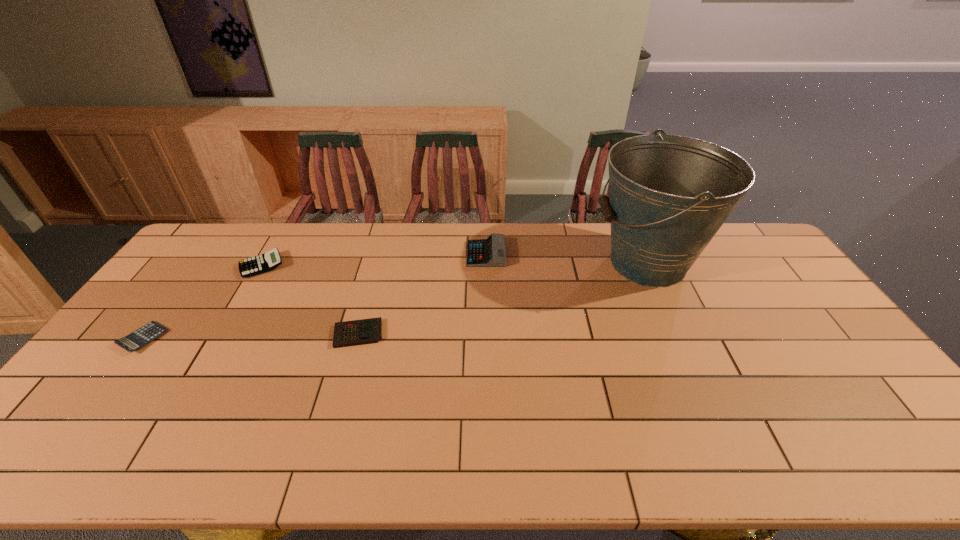
The height and width of the screenshot is (540, 960). Find the location of `free spot at the near edge of the desktop`. free spot at the near edge of the desktop is located at coordinates (385, 440).

Find the location of a particular element. The height and width of the screenshot is (540, 960). free space at the left edge is located at coordinates (187, 273).

At what (x,y) coordinates should I click in order to perform the action: click on vacant space at the right edge of the desktop. Please return your answer as a coordinate pair (x, y). Looking at the image, I should click on click(x=866, y=421).

Identify the location of free space that is in between the fourth object from left to right and the third object from left to right. (421, 294).

Where is `vacant area between the second object from right to left and the third object from left to right`? The width and height of the screenshot is (960, 540). vacant area between the second object from right to left and the third object from left to right is located at coordinates (421, 294).

Find the location of a particular element. vacant area between the third shortest object and the second calculator from right to left is located at coordinates (310, 300).

Locate an element on the screen. The height and width of the screenshot is (540, 960). vacant area that lies between the rightmost calculator and the leftmost calculator is located at coordinates (315, 296).

Locate an element on the screen. free space that is in between the tallest calculator and the shortest calculator is located at coordinates (315, 296).

Where is `vacant area that lies between the shortest object and the third object from left to right`? The width and height of the screenshot is (960, 540). vacant area that lies between the shortest object and the third object from left to right is located at coordinates (251, 336).

Locate an element on the screen. The width and height of the screenshot is (960, 540). blank region between the second tallest object and the tallest object is located at coordinates (566, 259).